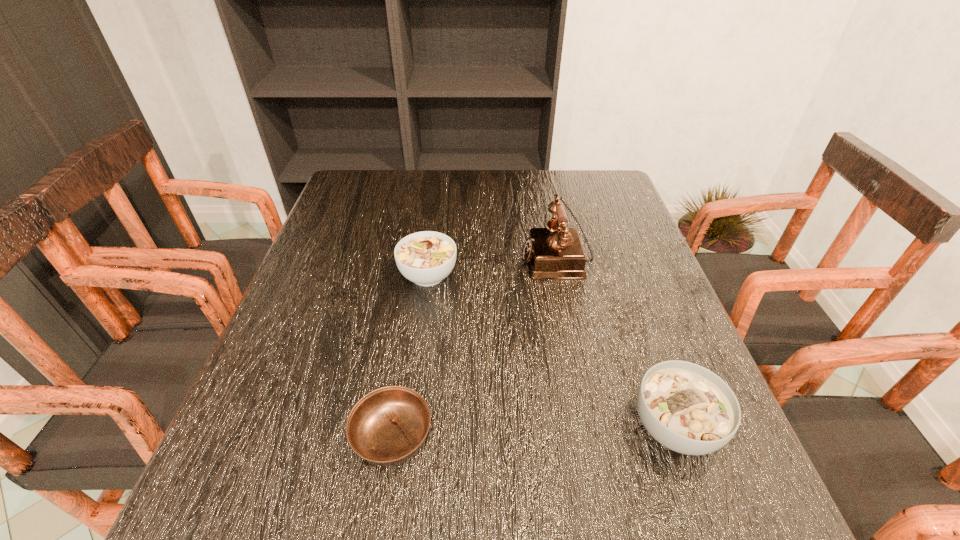
Where is `telephone`? The height and width of the screenshot is (540, 960). telephone is located at coordinates (556, 252).

Identify the location of the rightmost soup bowl. Image resolution: width=960 pixels, height=540 pixels. tap(687, 408).

Locate an element on the screen. Image resolution: width=960 pixels, height=540 pixels. the farthest soup bowl is located at coordinates (426, 258).

Where is `the shortest soup bowl`? The height and width of the screenshot is (540, 960). the shortest soup bowl is located at coordinates pos(387,426).

The width and height of the screenshot is (960, 540). I want to click on vacant area situated 0.100m on the dial of the telephone, so click(481, 258).

Identify the location of free point located 0.250m on the dial of the telephone. This screenshot has width=960, height=540. (420, 258).

At what (x,y) coordinates should I click in order to perform the action: click on vacant region located on the dial of the telephone. Please return your answer as a coordinate pair (x, y). This screenshot has width=960, height=540. Looking at the image, I should click on pyautogui.click(x=490, y=258).

Image resolution: width=960 pixels, height=540 pixels. Identify the location of vacant region located on the left of the rightmost soup bowl. (561, 427).

What are the coordinates of `free point located 0.140m on the right of the farthest soup bowl` in the screenshot? It's located at (516, 275).

Find the location of a particular element. free space located on the right of the shortest soup bowl is located at coordinates (568, 436).